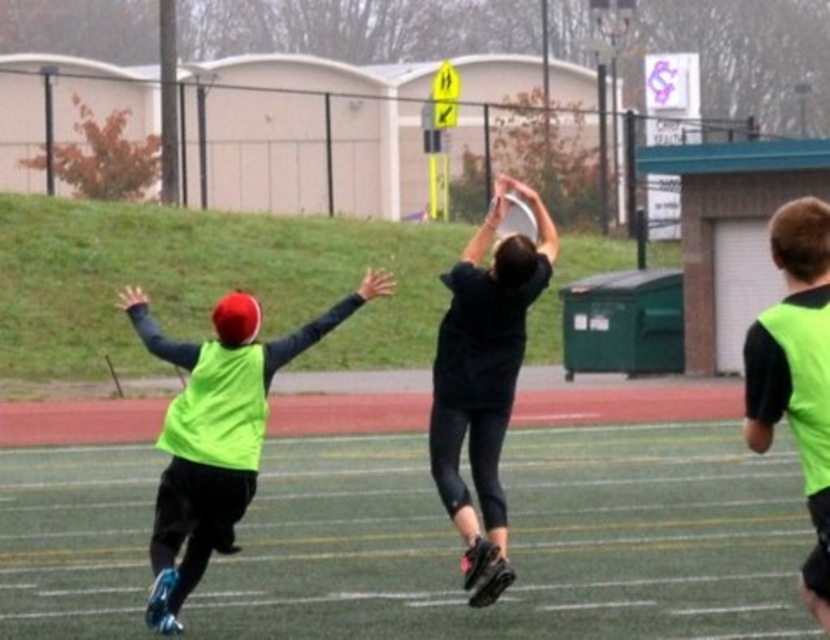
Based on the coordinates provided, what is located at point (521, 540) in the image?

The point (521, 540) marks the green synthetic turf at center.

You are a player in the ultimate frisbee game on the field. You see two points marked on the field. The first point is at coordinates point [785,611] and the second point is at point [538,208]. Which point is closer to you if you are standing at the center of the field?

Point [785,611] is in front of point [538,208], so if you are standing at the center of the field, the point that is closer to you is point [785,611].